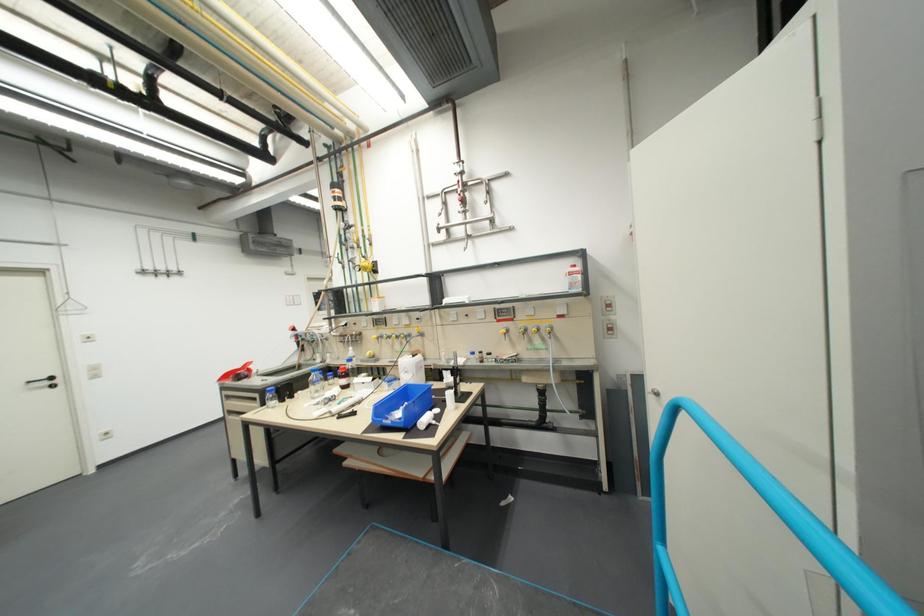
The width and height of the screenshot is (924, 616). I want to click on black door handle, so click(43, 381).